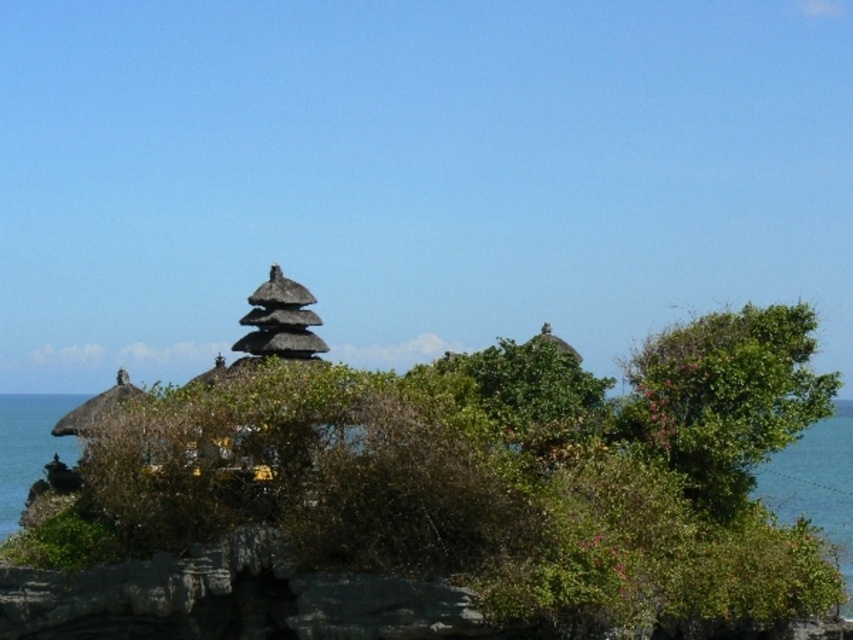
You are standing at the base of the temple and want to take a photo of both the green leafy bush at right and the blue water at lower right. Which object should you focus on first to ensure both are in clear view?

You should focus on the green leafy bush at right first because it is closer to you than the blue water at lower right, ensuring both are in focus when using depth of field.

You are a hiker who wants to take a photo of the temple. You notice the green leafy bush at right and the blue water at lower right in your viewfinder. Which object appears taller in the photo?

The blue water at lower right appears taller than the green leafy bush at right in the photo.

You are standing at the base of the temple structure and notice the green leafy bush at right and the blue water at lower right. Which object is positioned higher relative to the other?

The green leafy bush at right is above the blue water at lower right, so it is positioned higher.